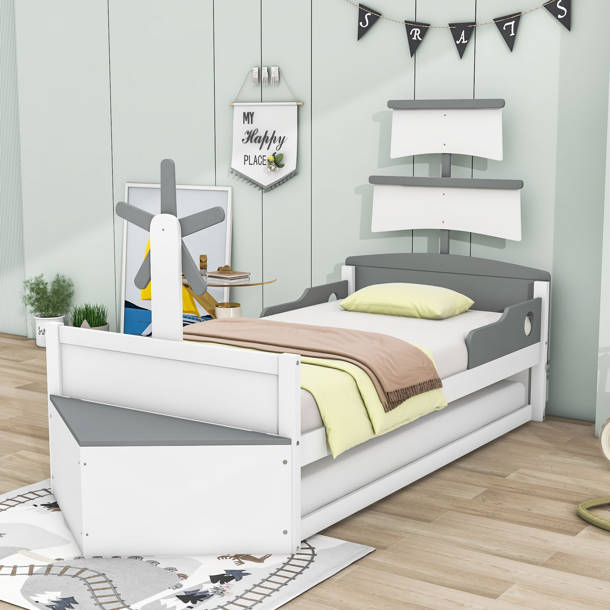
You are a GUI agent. You are given a task and a screenshot of the screen. Output one action in this format:
    pyautogui.click(x=<x>, y=<y>)
    Task: Click on the table
    
    Given the screenshot: What is the action you would take?
    pyautogui.click(x=231, y=282)